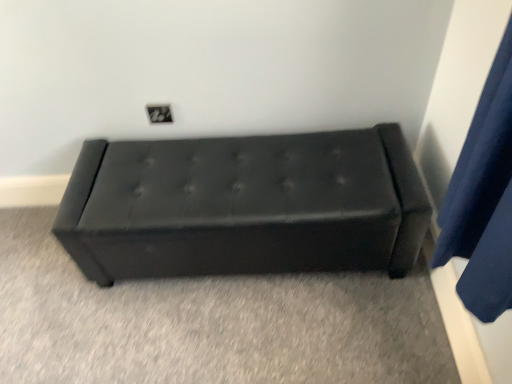
Find the location of a particular element. Image resolution: width=512 pixels, height=384 pixels. free space in front of black leather ottoman at center is located at coordinates (266, 340).